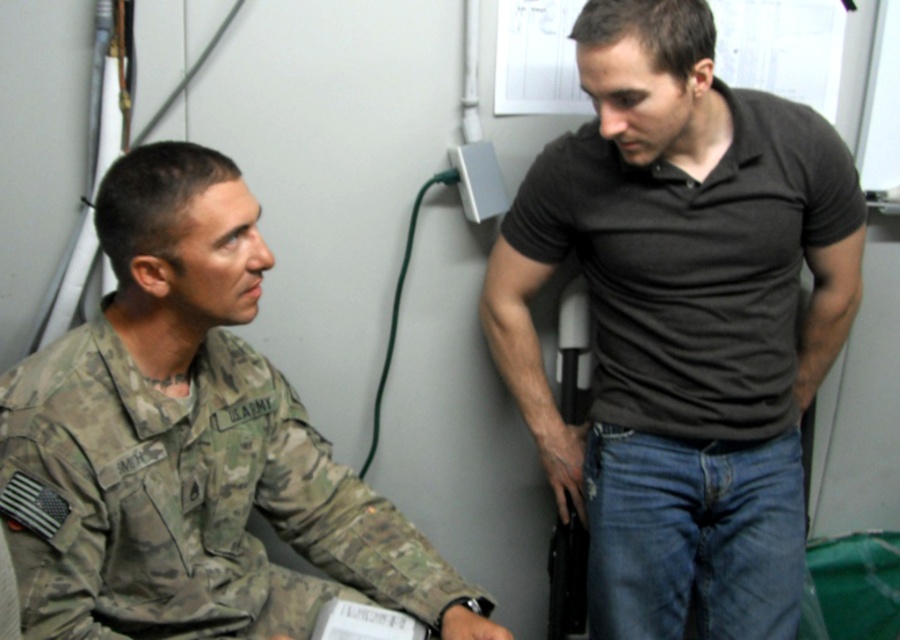
Does black cotton shirt at center appear on the right side of camouflage uniform at left?

Correct, you'll find black cotton shirt at center to the right of camouflage uniform at left.

Is point (596, 248) closer to viewer compared to point (309, 458)?

That is False.

This screenshot has width=900, height=640. What are the coordinates of `black cotton shirt at center` in the screenshot? It's located at (682, 323).